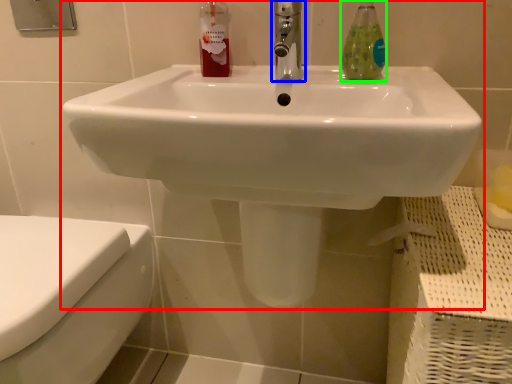
Question: Estimate the real-world distances between objects in this image. Which object is closer to sink (highlighted by a red box), tap (highlighted by a blue box) or soap dispenser (highlighted by a green box)?

Choices:
 (A) tap
 (B) soap dispenser

Answer: (A)